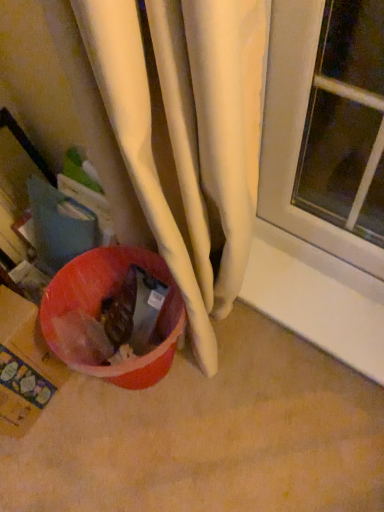
At what (x,y) coordinates should I click in order to perform the action: click on free spot in front of cardboard box at lower left. Please return your answer as a coordinate pair (x, y). Image resolution: width=384 pixels, height=512 pixels. Looking at the image, I should click on [48, 459].